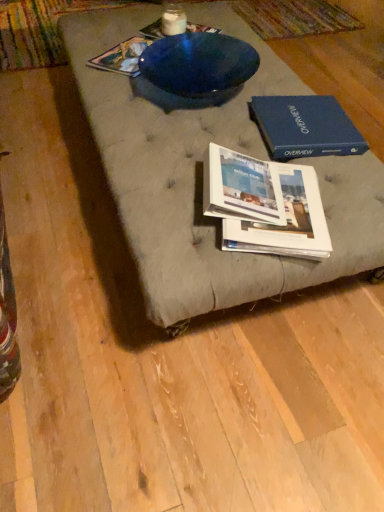
What do you see at coordinates (305, 127) in the screenshot?
I see `blue hardcover book at upper right` at bounding box center [305, 127].

Locate an element on the screen. blue glossy bowl at upper center, which appears as the 3th book when viewed from the front is located at coordinates (122, 57).

Measure the distance between white glossy book at center, which is the fourth book from back to front, and camera.

The distance of white glossy book at center, which is the fourth book from back to front, from camera is 38.36 inches.

Where is `blue glossy bowl at upper center, the first book positioned from the top`? The image size is (384, 512). blue glossy bowl at upper center, the first book positioned from the top is located at coordinates tap(153, 30).

Can you confirm if blue glossy bowl at upper center, placed as the second book when sorted from back to front, is bigger than blue glossy bowl at upper center, the first book positioned from the top?

Yes.

Considering the positions of objects blue glossy bowl at upper center, which appears as the 3th book when viewed from the front, and blue glossy bowl at upper center, which is the fourth book from front to back, in the image provided, who is more to the left, blue glossy bowl at upper center, which appears as the 3th book when viewed from the front, or blue glossy bowl at upper center, which is the fourth book from front to back,?

blue glossy bowl at upper center, which appears as the 3th book when viewed from the front, is more to the left.

You are a GUI agent. You are given a task and a screenshot of the screen. Output one action in this format:
    pyautogui.click(x=<x>, y=<y>)
    Task: Click on the book located on the left of blue glossy bowl at upper center, which is the fourth book from front to back
    This screenshot has height=512, width=384.
    Given the screenshot: What is the action you would take?
    (x=122, y=57)

From the image's perspective, between blue glossy bowl at upper center, which appears as the 3th book when viewed from the front, and blue glossy bowl at upper center, the 1th book when ordered from back to front, who is located below?

blue glossy bowl at upper center, which appears as the 3th book when viewed from the front, appears lower in the image.

In the scene shown: From a real-world perspective, is white glossy book at center, which is the 3th book from back to front, on top of textured gray cushion at center?

Yes, from a real-world perspective, white glossy book at center, which is the 3th book from back to front, is over textured gray cushion at center

Consider the image. Is white glossy book at center, which is the 3th book from back to front, at the right side of textured gray cushion at center?

No.

From the image's perspective, who appears lower, white glossy book at center, which is the 3th book from back to front, or textured gray cushion at center?

white glossy book at center, which is the 3th book from back to front.

What's the angular difference between white glossy book at center, which ranks as the first book in bottom-to-top order, and textured gray cushion at center's facing directions?

The facing directions of white glossy book at center, which ranks as the first book in bottom-to-top order, and textured gray cushion at center are 66.9 degrees apart.

What's the angular difference between blue hardcover book at upper right and white glossy book at center, the third book viewed from the top,'s facing directions?

101 degrees separate the facing orientations of blue hardcover book at upper right and white glossy book at center, the third book viewed from the top.

Do you think blue hardcover book at upper right is within white glossy book at center, the second book positioned from the bottom, or outside of it?

The correct answer is: outside.

In the scene shown: Which is closer, (321, 137) or (221, 196)?

Point (321, 137) is farther from the camera than point (221, 196).

From a real-world perspective, is blue hardcover book at upper right located higher than white glossy book at center, arranged as the first book when viewed from the front?

Incorrect, from a real-world perspective, blue hardcover book at upper right is lower than white glossy book at center, arranged as the first book when viewed from the front.

From the image's perspective, is white glossy book at center, the third book viewed from the top, below blue hardcover book at upper right?

Yes, from the image's perspective, white glossy book at center, the third book viewed from the top, is below blue hardcover book at upper right.

From a real-world perspective, is white glossy book at center, the second book positioned from the bottom, physically above blue hardcover book at upper right?

Yes, from a real-world perspective, white glossy book at center, the second book positioned from the bottom, is above blue hardcover book at upper right.

Are white glossy book at center, the third book viewed from the top, and blue hardcover book at upper right far apart?

No.

What's the angular difference between white glossy book at center, arranged as the first book when viewed from the front, and blue hardcover book at upper right's facing directions?

101 degrees.

Considering the sizes of blue hardcover book at upper right and blue glossy bowl at upper center, which is the fourth book from front to back, in the image, is blue hardcover book at upper right taller or shorter than blue glossy bowl at upper center, which is the fourth book from front to back,?

Clearly, blue hardcover book at upper right is taller compared to blue glossy bowl at upper center, which is the fourth book from front to back.

Is blue hardcover book at upper right looking in the opposite direction of blue glossy bowl at upper center, the 1th book when ordered from back to front?

blue hardcover book at upper right is not turned away from blue glossy bowl at upper center, the 1th book when ordered from back to front.

Is blue hardcover book at upper right at the right side of blue glossy bowl at upper center, the 1th book when ordered from back to front?

Indeed, blue hardcover book at upper right is positioned on the right side of blue glossy bowl at upper center, the 1th book when ordered from back to front.

Can you tell me how much blue hardcover book at upper right and blue glossy bowl at upper center, the 1th book when ordered from back to front, differ in facing direction?

There is a 39.4-degree angle between the facing directions of blue hardcover book at upper right and blue glossy bowl at upper center, the 1th book when ordered from back to front.

Considering the relative sizes of textured gray cushion at center and white glossy book at center, acting as the second book starting from the front, in the image provided, is textured gray cushion at center taller than white glossy book at center, acting as the second book starting from the front,?

No.

Does point (157, 252) lie in front of point (235, 193)?

Yes, it is.

Is textured gray cushion at center further to camera compared to white glossy book at center, which is counted as the 4th book, starting from the top?

No, the depth of textured gray cushion at center is less than that of white glossy book at center, which is counted as the 4th book, starting from the top.

At what (x,y) coordinates should I click in order to perform the action: click on coffee table in front of the white glossy book at center, acting as the second book starting from the front. Please return your answer as a coordinate pair (x, y). The width and height of the screenshot is (384, 512). Looking at the image, I should click on (202, 173).

Considering the relative sizes of white glossy book at center, which is counted as the 4th book, starting from the top, and blue glossy bowl at upper center, the 1th book when ordered from back to front, in the image provided, is white glossy book at center, which is counted as the 4th book, starting from the top, taller than blue glossy bowl at upper center, the 1th book when ordered from back to front,?

Correct, white glossy book at center, which is counted as the 4th book, starting from the top, is much taller as blue glossy bowl at upper center, the 1th book when ordered from back to front.

Which point is more forward, (317, 192) or (194, 26)?

The point (317, 192) is in front.

Could you tell me if white glossy book at center, which is the 3th book from back to front, is turned towards blue glossy bowl at upper center, the 1th book when ordered from back to front?

Yes, white glossy book at center, which is the 3th book from back to front, is facing blue glossy bowl at upper center, the 1th book when ordered from back to front.

Based on the photo, between white glossy book at center, which is counted as the 4th book, starting from the top, and blue glossy bowl at upper center, marked as the fourth book in a bottom-to-top arrangement, which one has smaller width?

With smaller width is blue glossy bowl at upper center, marked as the fourth book in a bottom-to-top arrangement.

Locate an element on the screen. The width and height of the screenshot is (384, 512). book behind the blue glossy bowl at upper center, positioned as the third book in bottom-to-top order is located at coordinates (153, 30).

From the image's perspective, starting from the textured gray cushion at center, which book is the 3rd one below? Please provide its 2D coordinates.

[(265, 204)]

From the image, which object appears to be farther from white glossy book at center, the second book positioned from the bottom, textured gray cushion at center or blue glossy bowl at upper center, which is the fourth book from front to back?

blue glossy bowl at upper center, which is the fourth book from front to back, lies further to white glossy book at center, the second book positioned from the bottom, than the other object.

Estimate the real-world distances between objects in this image. Which object is further from textured gray cushion at center, blue hardcover book at upper right or white glossy book at center, the third book viewed from the top?

white glossy book at center, the third book viewed from the top.

From the image, which object appears to be farther from white glossy book at center, acting as the second book starting from the front, blue glossy bowl at upper center, which is the fourth book from front to back, or textured gray cushion at center?

blue glossy bowl at upper center, which is the fourth book from front to back, is further to white glossy book at center, acting as the second book starting from the front.

Looking at the image, which one is located further to blue hardcover book at upper right, blue glossy bowl at upper center, positioned as the third book in bottom-to-top order, or blue glossy bowl at upper center, the first book positioned from the top?

Among the two, blue glossy bowl at upper center, the first book positioned from the top, is located further to blue hardcover book at upper right.

Looking at the image, which one is located further to white glossy book at center, arranged as the first book when viewed from the front, white glossy book at center, acting as the second book starting from the front, or blue hardcover book at upper right?

blue hardcover book at upper right is further to white glossy book at center, arranged as the first book when viewed from the front.

Based on the photo, from the image, which object appears to be nearer to white glossy book at center, which ranks as the first book in bottom-to-top order, blue glossy bowl at upper center, the 1th book when ordered from back to front, or white glossy book at center, the second book positioned from the bottom?

white glossy book at center, the second book positioned from the bottom.

When comparing their distances from white glossy book at center, arranged as the first book when viewed from the front, does blue glossy bowl at upper center, which is the fourth book from front to back, or blue hardcover book at upper right seem closer?

The object closer to white glossy book at center, arranged as the first book when viewed from the front, is blue hardcover book at upper right.

From the image, which object appears to be farther from textured gray cushion at center, white glossy book at center, which ranks as the first book in bottom-to-top order, or blue glossy bowl at upper center, positioned as the third book in bottom-to-top order?

blue glossy bowl at upper center, positioned as the third book in bottom-to-top order, is positioned further to the anchor textured gray cushion at center.

Where is `paperback book between textured gray cushion at center and white glossy book at center, which ranks as the first book in bottom-to-top order, vertically`? paperback book between textured gray cushion at center and white glossy book at center, which ranks as the first book in bottom-to-top order, vertically is located at coordinates (305, 127).

Where is `paperback book between textured gray cushion at center and blue glossy bowl at upper center, placed as the second book when sorted from back to front, along the z-axis`? paperback book between textured gray cushion at center and blue glossy bowl at upper center, placed as the second book when sorted from back to front, along the z-axis is located at coordinates (305, 127).

Locate an element on the screen. This screenshot has height=512, width=384. book between blue glossy bowl at upper center, which appears as the 3th book when viewed from the front, and white glossy book at center, which is counted as the 4th book, starting from the top, in the vertical direction is located at coordinates (240, 188).

The width and height of the screenshot is (384, 512). I want to click on paperback book between blue glossy bowl at upper center, the 1th book when ordered from back to front, and white glossy book at center, arranged as the first book when viewed from the front, in the vertical direction, so click(x=305, y=127).